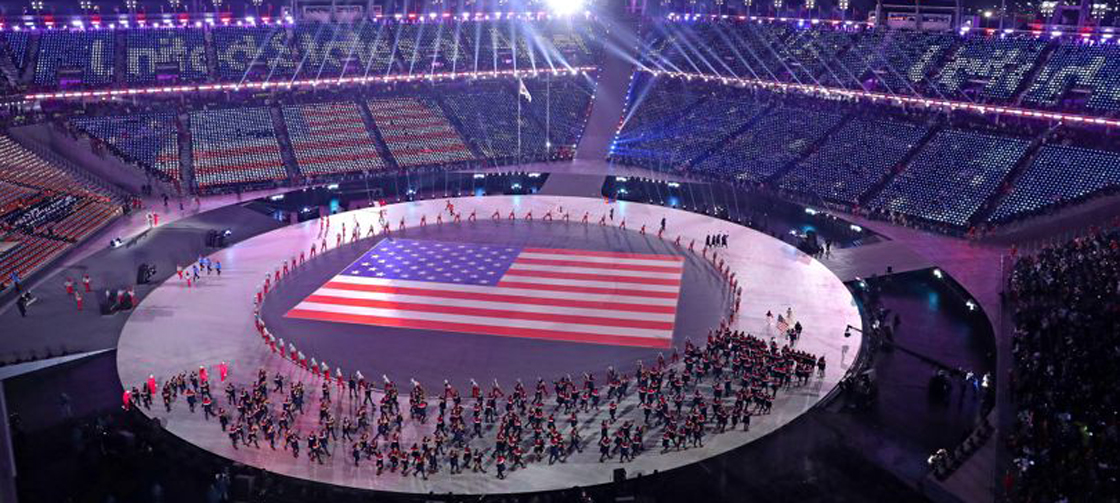
In order to click on footlights in this screenshot , I will do `click(974, 308)`, `click(939, 451)`, `click(936, 274)`, `click(858, 232)`, `click(810, 208)`, `click(672, 185)`, `click(616, 186)`, `click(532, 177)`, `click(476, 180)`, `click(334, 191)`.